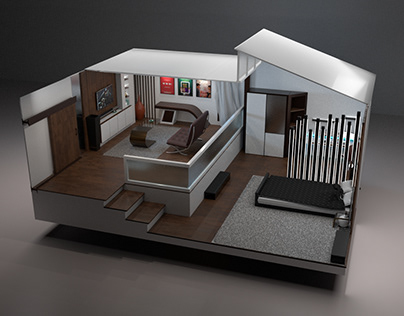
Find the location of a particular element. This screenshot has height=316, width=404. black door handle is located at coordinates (76, 131).